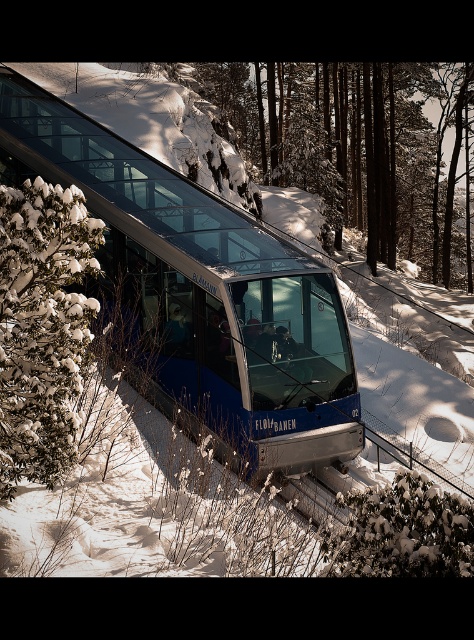
You are a passenger sitting inside the tram and looking out the window. You notice two points marked on the window. The first point is at coordinate point (188,358) and the second is at point (58,260). Which point is closer to you?

Point (188,358) is closer to you because it is further to the viewer than point (58,260).

You are a passenger on the BLAUMANN tram and want to look out the window at the point marked by the coordinates point (201,291). What will you see outside the window at that point?

The point (201,291) corresponds to the metallic blue train at center, so you will see the metallic blue train at center outside the window at that point.